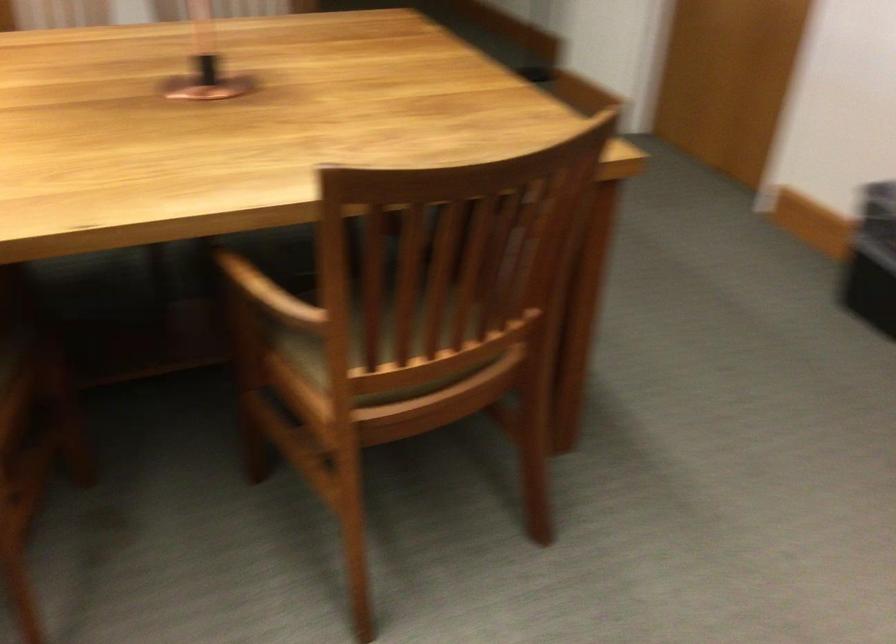
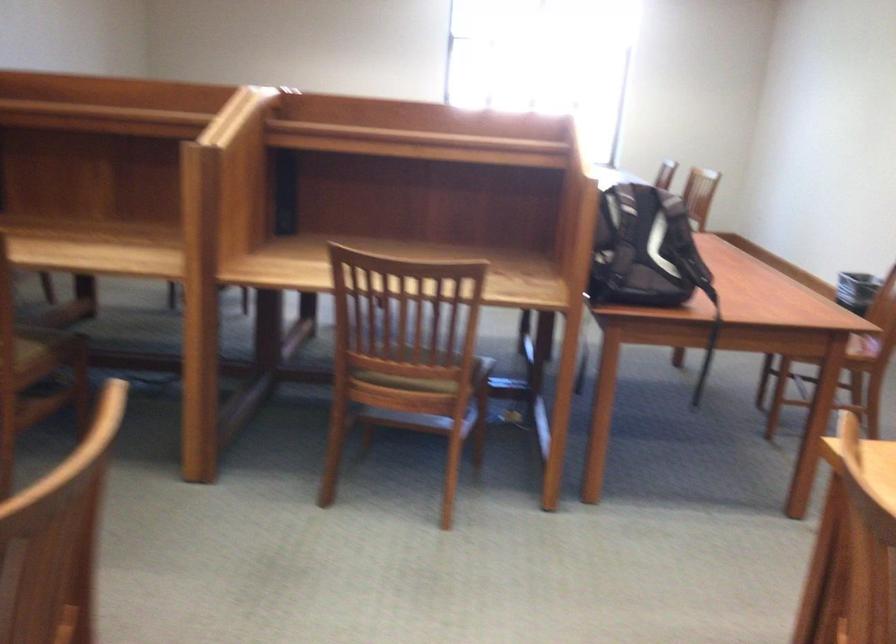
The first image is from the beginning of the video and the second image is from the end. How did the camera likely rotate when shooting the video?

The rotation direction of the camera is left-down.